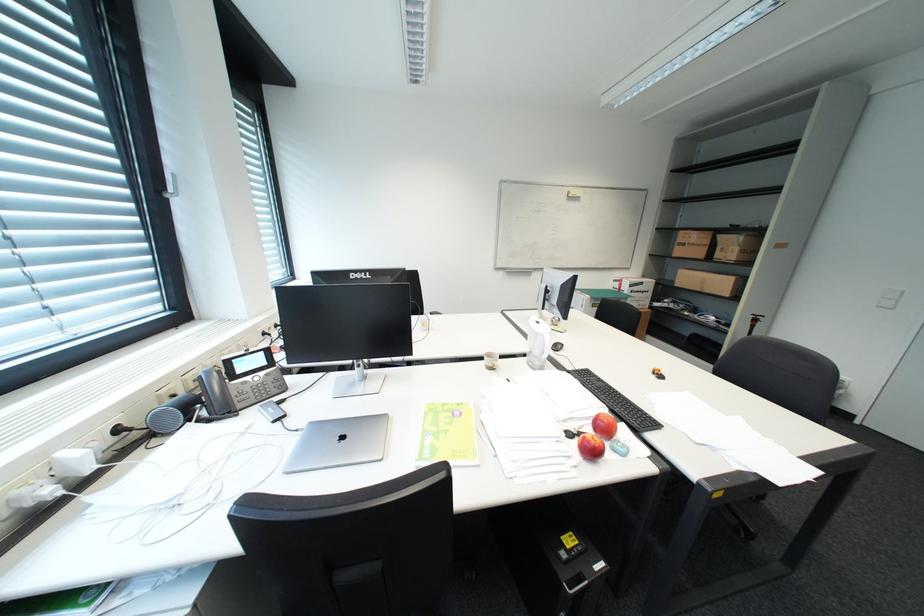
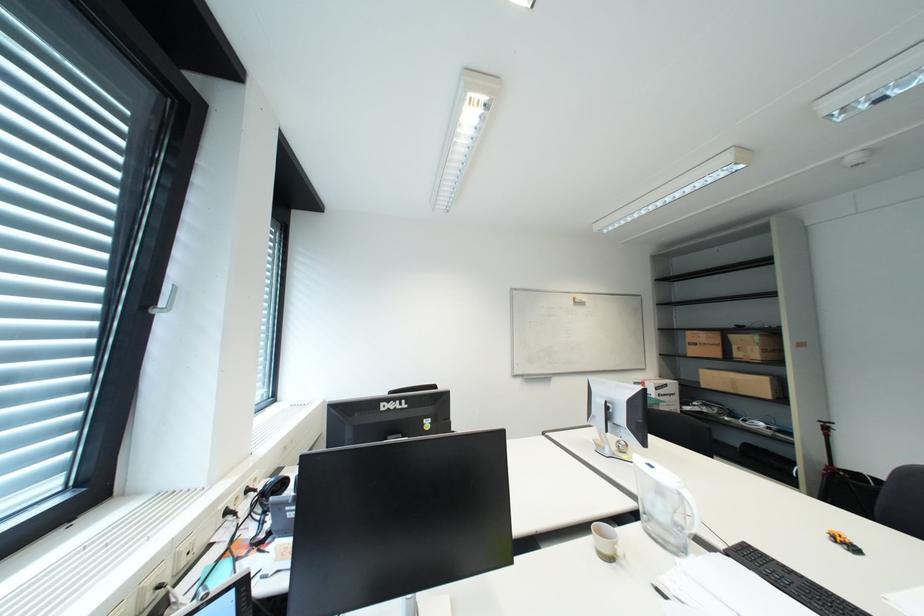
In a continuous first-person perspective shot, in which direction is the camera moving?

The cameraman walked toward left, forward.